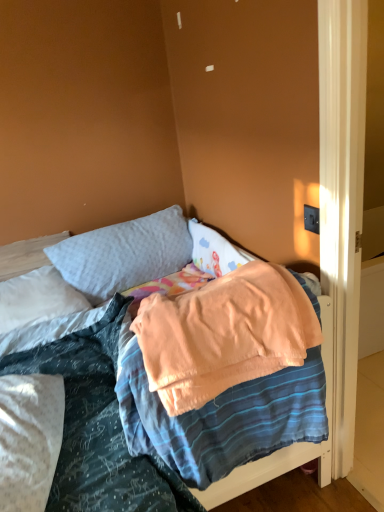
Where is `white soft pillow at upper left, which appears as the second pillow when viewed from the right`? Image resolution: width=384 pixels, height=512 pixels. white soft pillow at upper left, which appears as the second pillow when viewed from the right is located at coordinates (37, 298).

Where is `white soft pillow at upper left, which appears as the second pillow when viewed from the right`? white soft pillow at upper left, which appears as the second pillow when viewed from the right is located at coordinates (37, 298).

Is soft gray pillow at upper center, which is the second pillow from left to right, at the left side of white soft pillow at upper left, which appears as the second pillow when viewed from the right?

No.

Does soft gray pillow at upper center, the 1th pillow viewed from the right, turn towards white soft pillow at upper left, which appears as the first pillow when viewed from the left?

No, soft gray pillow at upper center, the 1th pillow viewed from the right, is not facing towards white soft pillow at upper left, which appears as the first pillow when viewed from the left.

Is soft gray pillow at upper center, the 1th pillow viewed from the right, bigger or smaller than white soft pillow at upper left, which appears as the second pillow when viewed from the right?

In the image, soft gray pillow at upper center, the 1th pillow viewed from the right, appears to be larger than white soft pillow at upper left, which appears as the second pillow when viewed from the right.

Is soft peach blanket at center oriented towards white soft pillow at upper left, which appears as the second pillow when viewed from the right?

No, soft peach blanket at center is not turned towards white soft pillow at upper left, which appears as the second pillow when viewed from the right.

Consider the image. Is white soft pillow at upper left, which appears as the first pillow when viewed from the left, located within soft peach blanket at center?

No, white soft pillow at upper left, which appears as the first pillow when viewed from the left, is not surrounded by soft peach blanket at center.

Consider the image. Which object is further away from the camera taking this photo, soft peach blanket at center or white soft pillow at upper left, which appears as the second pillow when viewed from the right?

white soft pillow at upper left, which appears as the second pillow when viewed from the right.

The width and height of the screenshot is (384, 512). Find the location of `blanket that is on the right side of white soft pillow at upper left, which appears as the second pillow when viewed from the right`. blanket that is on the right side of white soft pillow at upper left, which appears as the second pillow when viewed from the right is located at coordinates (221, 418).

Considering the relative sizes of white soft pillow at upper left, which appears as the first pillow when viewed from the left, and soft peach blanket at center in the image provided, is white soft pillow at upper left, which appears as the first pillow when viewed from the left, wider than soft peach blanket at center?

No.

How much distance is there between white soft pillow at upper left, which appears as the second pillow when viewed from the right, and soft peach blanket at center?

They are 98.66 centimeters apart.

What are the coordinates of `blanket on the right of white soft pillow at upper left, which appears as the second pillow when viewed from the right` in the screenshot? It's located at (221, 418).

From the image's perspective, which one is positioned higher, white soft pillow at upper left, which appears as the second pillow when viewed from the right, or soft peach blanket at center?

white soft pillow at upper left, which appears as the second pillow when viewed from the right, from the image's perspective.

Considering the relative sizes of white soft pillow at upper left, which appears as the second pillow when viewed from the right, and soft gray pillow at upper center, which is the second pillow from left to right, in the image provided, is white soft pillow at upper left, which appears as the second pillow when viewed from the right, thinner than soft gray pillow at upper center, which is the second pillow from left to right,?

Incorrect, the width of white soft pillow at upper left, which appears as the second pillow when viewed from the right, is not less than that of soft gray pillow at upper center, which is the second pillow from left to right.

From the image's perspective, is white soft pillow at upper left, which appears as the first pillow when viewed from the left, above soft gray pillow at upper center, which is the second pillow from left to right?

No, from the image's perspective, white soft pillow at upper left, which appears as the first pillow when viewed from the left, is not above soft gray pillow at upper center, which is the second pillow from left to right.

Where is `pillow positioned vertically above the white soft pillow at upper left, which appears as the first pillow when viewed from the left (from a real-world perspective)`? The image size is (384, 512). pillow positioned vertically above the white soft pillow at upper left, which appears as the first pillow when viewed from the left (from a real-world perspective) is located at coordinates (124, 254).

Is point (42, 281) closer or farther from the camera than point (88, 261)?

Point (42, 281) appears to be closer to the viewer than point (88, 261).

Is point (97, 293) positioned after point (193, 453)?

Yes, point (97, 293) is behind point (193, 453).

Is soft gray pillow at upper center, which is the second pillow from left to right, in front of or behind soft peach blanket at center in the image?

Visually, soft gray pillow at upper center, which is the second pillow from left to right, is located behind soft peach blanket at center.

Looking at this image, in terms of height, does soft gray pillow at upper center, which is the second pillow from left to right, look taller or shorter compared to soft peach blanket at center?

Considering their sizes, soft gray pillow at upper center, which is the second pillow from left to right, has less height than soft peach blanket at center.

Does point (158, 419) lie in front of point (134, 247)?

Yes, it is.

From the image's perspective, relative to soft gray pillow at upper center, which is the second pillow from left to right, is soft peach blanket at center above or below?

soft peach blanket at center is situated lower than soft gray pillow at upper center, which is the second pillow from left to right, in the image.

How many degrees apart are the facing directions of soft peach blanket at center and soft gray pillow at upper center, the 1th pillow viewed from the right?

They differ by 3.79 degrees in their facing directions.

Considering the positions of objects soft peach blanket at center and soft gray pillow at upper center, which is the second pillow from left to right, in the image provided, who is in front, soft peach blanket at center or soft gray pillow at upper center, which is the second pillow from left to right,?

soft peach blanket at center is more forward.

At what (x,y) coordinates should I click in order to perform the action: click on pillow in front of the soft gray pillow at upper center, the 1th pillow viewed from the right. Please return your answer as a coordinate pair (x, y). Looking at the image, I should click on (37, 298).

Where is `the 1st pillow behind the soft peach blanket at center`? The width and height of the screenshot is (384, 512). the 1st pillow behind the soft peach blanket at center is located at coordinates (37, 298).

Considering their positions, is soft gray pillow at upper center, which is the second pillow from left to right, positioned further to white soft pillow at upper left, which appears as the first pillow when viewed from the left, than soft peach blanket at center?

soft peach blanket at center lies further to white soft pillow at upper left, which appears as the first pillow when viewed from the left, than the other object.

Considering their positions, is soft gray pillow at upper center, which is the second pillow from left to right, positioned further to soft peach blanket at center than white soft pillow at upper left, which appears as the first pillow when viewed from the left?

→ The object further to soft peach blanket at center is soft gray pillow at upper center, which is the second pillow from left to right.

When comparing their distances from white soft pillow at upper left, which appears as the second pillow when viewed from the right, does soft peach blanket at center or soft gray pillow at upper center, the 1th pillow viewed from the right, seem further?

soft peach blanket at center is positioned further to the anchor white soft pillow at upper left, which appears as the second pillow when viewed from the right.

Looking at this image, from the image, which object appears to be nearer to soft gray pillow at upper center, which is the second pillow from left to right, soft peach blanket at center or white soft pillow at upper left, which appears as the second pillow when viewed from the right?

Among the two, white soft pillow at upper left, which appears as the second pillow when viewed from the right, is located nearer to soft gray pillow at upper center, which is the second pillow from left to right.

Considering their positions, is white soft pillow at upper left, which appears as the second pillow when viewed from the right, positioned further to soft gray pillow at upper center, the 1th pillow viewed from the right, than soft peach blanket at center?

Based on the image, soft peach blanket at center appears to be further to soft gray pillow at upper center, the 1th pillow viewed from the right.

When comparing their distances from soft peach blanket at center, does white soft pillow at upper left, which appears as the first pillow when viewed from the left, or soft gray pillow at upper center, the 1th pillow viewed from the right, seem closer?

Based on the image, white soft pillow at upper left, which appears as the first pillow when viewed from the left, appears to be nearer to soft peach blanket at center.

This screenshot has height=512, width=384. Find the location of `pillow between soft peach blanket at center and soft gray pillow at upper center, the 1th pillow viewed from the right, along the z-axis`. pillow between soft peach blanket at center and soft gray pillow at upper center, the 1th pillow viewed from the right, along the z-axis is located at coordinates (37, 298).